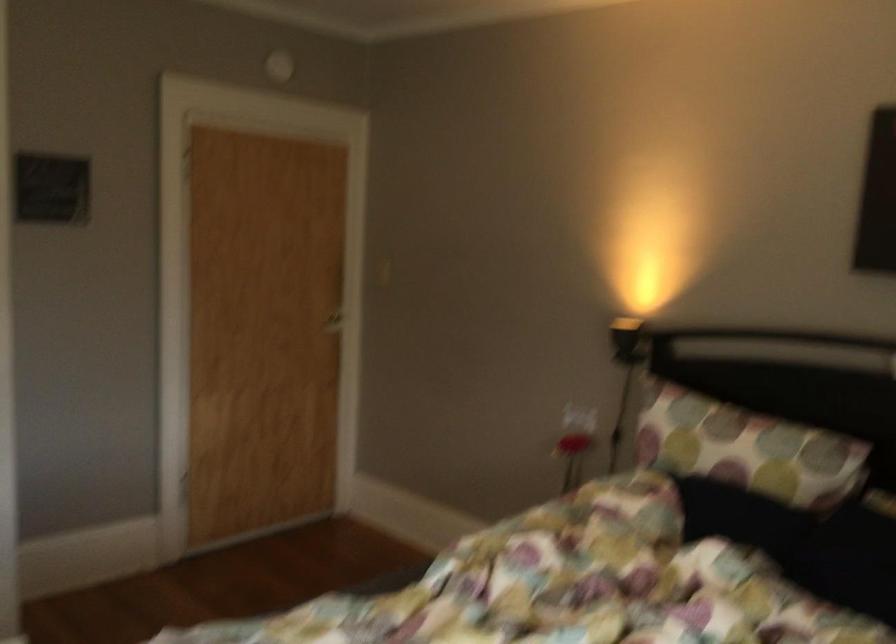
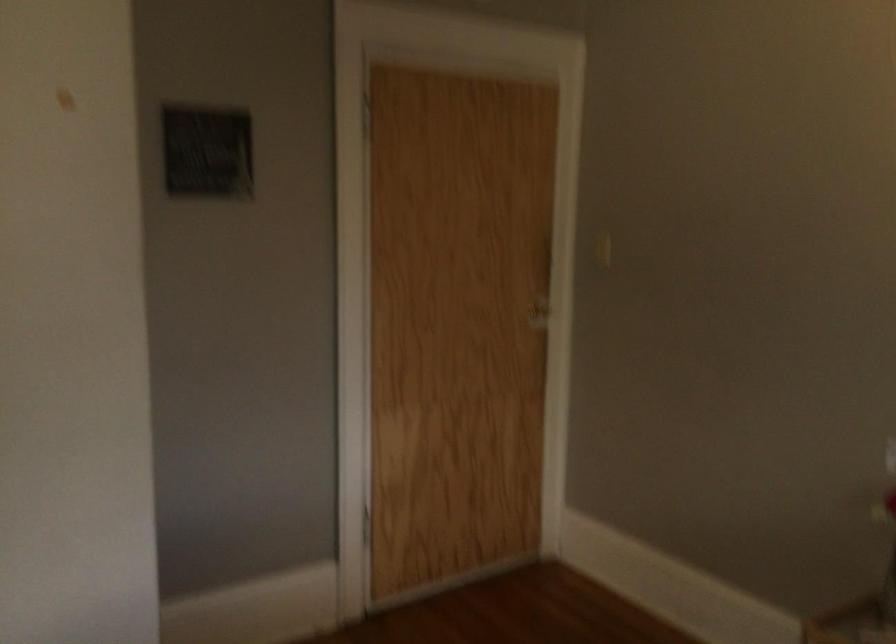
Question: The images are taken continuously from a first-person perspective. In which direction is your viewpoint rotating?

Choices:
 (A) Left
 (B) Right
 (C) Up
 (D) Down

Answer: (A)